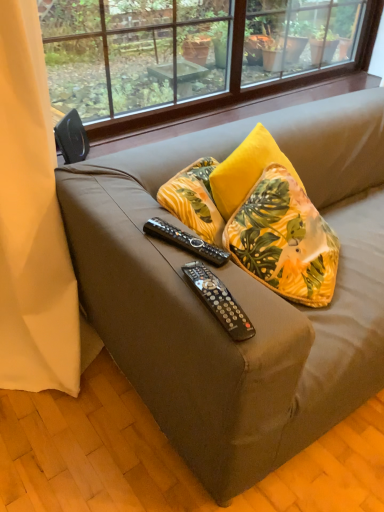
The image size is (384, 512). What are the coordinates of `vacant area in front of black plastic remote control at center, which is the 2th remote control from bottom to top` in the screenshot? It's located at (192, 283).